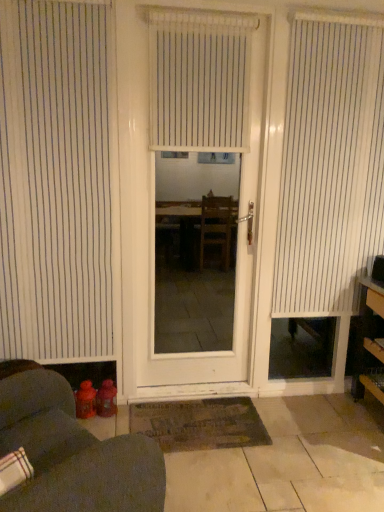
Find the location of a particular element. free space in front of dark brown textured mat at center is located at coordinates (224, 479).